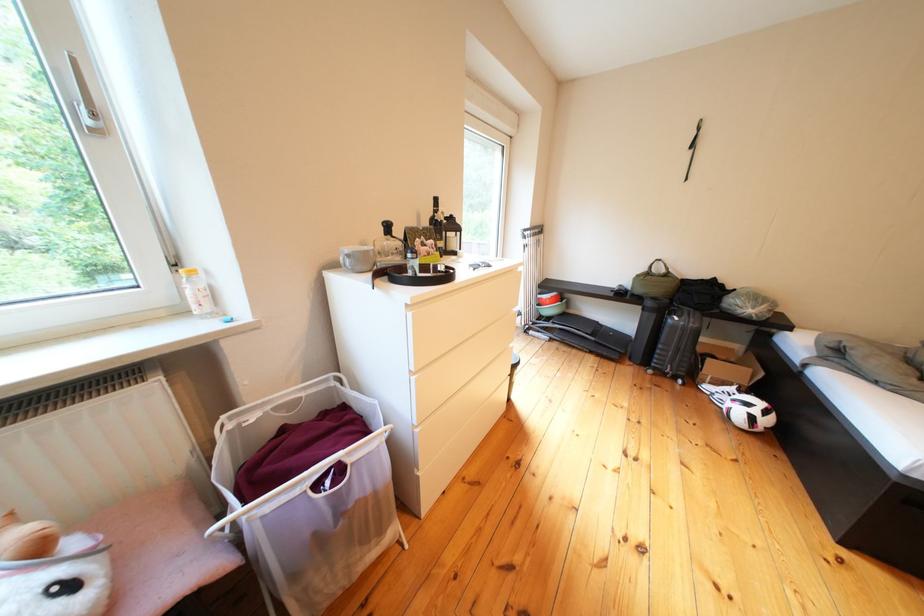
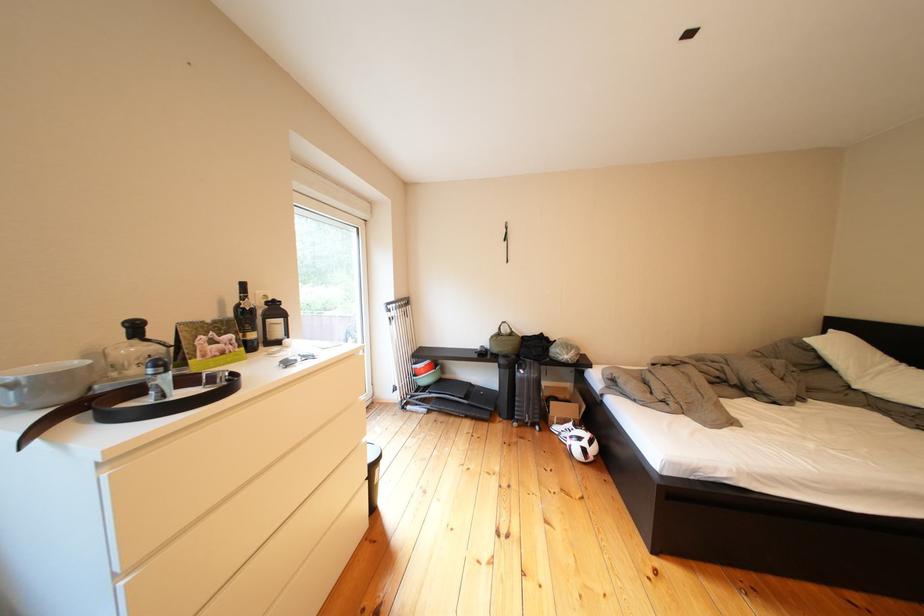
Find the pixel in the second image that matches pixel 586 315 in the first image.

(462, 381)